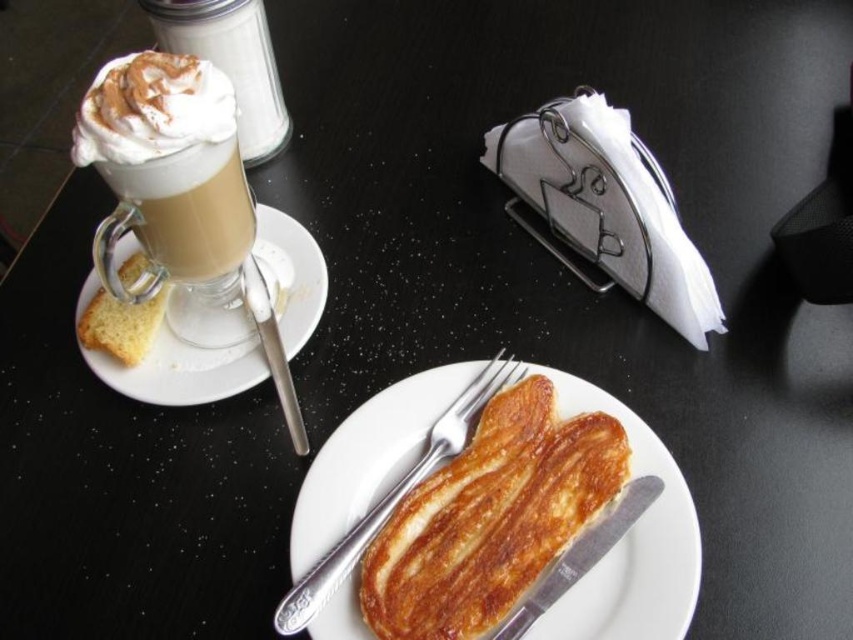
You are a customer at the table and want to reach for the item located at point (129, 333). However, there is an obstacle at point (294, 419). Will you be able to reach the item without moving the obstacle?

Point (129, 333) is behind point (294, 419), so you cannot reach the item at point (129, 333) without moving the obstacle at point (294, 419).

You are a waiter at a restaurant and need to place a new dessert menu on the table. The menu is 10 cm wide and must be placed in an area that doesn not overlap with the matte glass cup at upper left. Where should you place it?

Since the matte glass cup at upper left is located at point (x=180, y=212), you should place the dessert menu in an area of the table that is not overlapping with the cup. The exact coordinates depend on the table size, but ensuring a 10 cm distance from the cup would be safe.